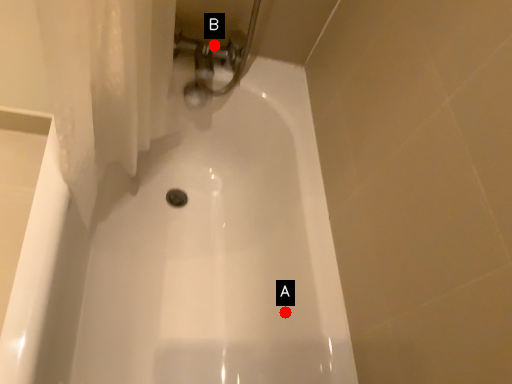
Question: Two points are circled on the image, labeled by A and B beside each circle. Among these points, which one is nearest to the camera?

Choices:
 (A) A is closer
 (B) B is closer

Answer: (A)